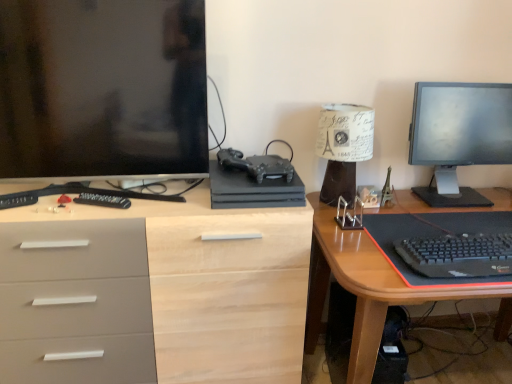
At what (x,y) coordinates should I click in order to perform the action: click on free space between matte black monitor at upper right and white paper lampshade at upper right. Please return your answer as a coordinate pair (x, y). Image resolution: width=512 pixels, height=384 pixels. Looking at the image, I should click on (388, 197).